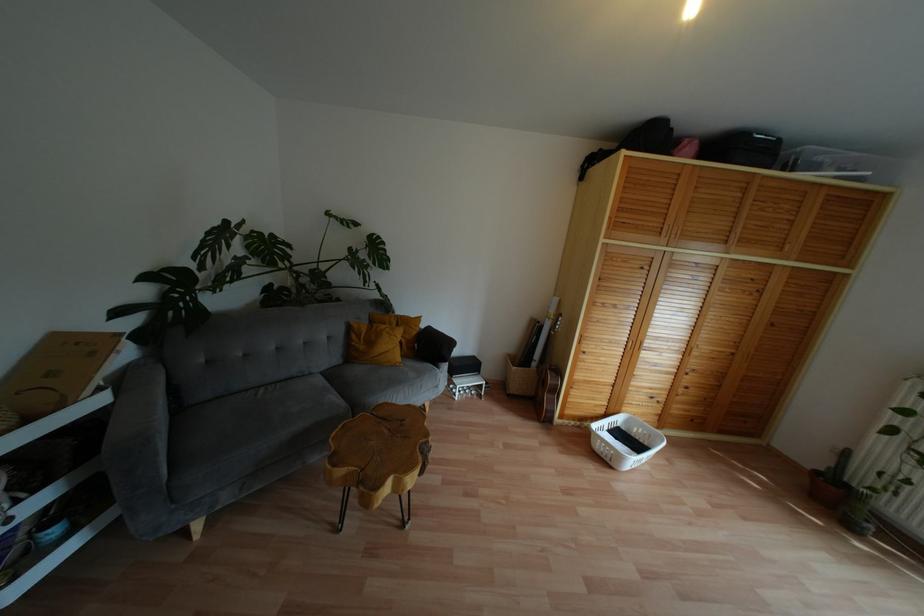
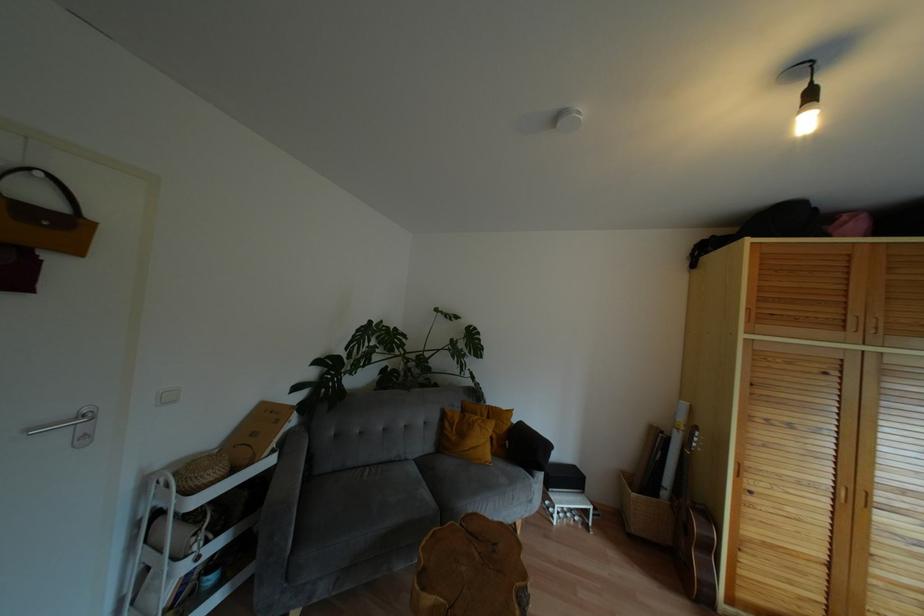
The point at (513,389) is marked in the first image. Where is the corresponding point in the second image?

(636, 527)